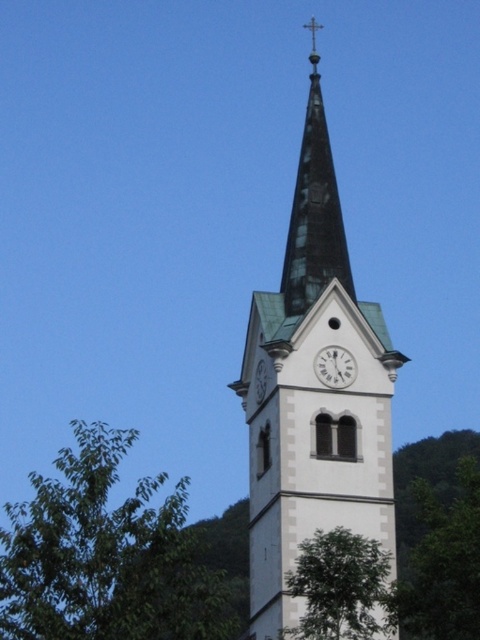
Which is in front, point (379, 339) or point (336, 616)?

Point (336, 616) is more forward.

In the scene shown: Which is more to the left, white smooth clock tower at center or green leafy tree at lower right?

white smooth clock tower at center is more to the left.

Who is more forward, (288, 342) or (367, 560)?

Point (367, 560)

Where is `white smooth clock tower at center`? This screenshot has width=480, height=640. white smooth clock tower at center is located at coordinates (313, 392).

Is green leafy tree at lower right below white metallic clock at center?

Correct, green leafy tree at lower right is located below white metallic clock at center.

Based on the photo, is green leafy tree at lower right bigger than white metallic clock at center?

Indeed, green leafy tree at lower right has a larger size compared to white metallic clock at center.

I want to click on green leafy tree at lower right, so click(x=340, y=588).

I want to click on green leafy tree at lower right, so click(x=340, y=588).

Is shiny black glass spire at upper center bigger than white metallic clock at center?

Correct, shiny black glass spire at upper center is larger in size than white metallic clock at center.

Does shiny black glass spire at upper center appear on the left side of white metallic clock at center?

Correct, you'll find shiny black glass spire at upper center to the left of white metallic clock at center.

Measure the distance between point (322,170) and camera.

Point (322,170) and camera are 81.48 meters apart.

Locate an element on the screen. shiny black glass spire at upper center is located at coordinates (314, 211).